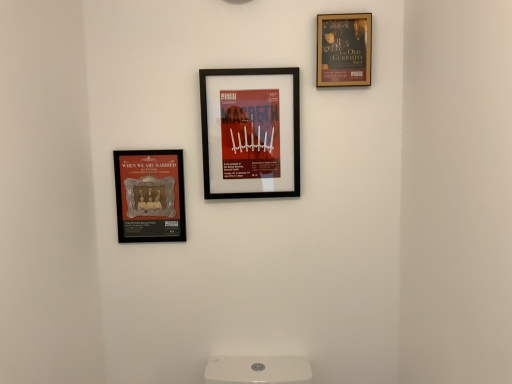
Question: Choose the correct answer: Is gold-framed poster at upper right, the first picture frame positioned from the right, inside matte black picture frame at center, marked as the 2th picture frame in a right-to-left arrangement, or outside it?

Choices:
 (A) inside
 (B) outside

Answer: (B)

Question: Is point (320, 23) closer or farther from the camera than point (232, 190)?

Choices:
 (A) farther
 (B) closer

Answer: (B)

Question: Which is nearer to the gold-framed poster at upper right, the first picture frame positioned from the right?

Choices:
 (A) matte gold plaque at left, the 3th picture frame when ordered from right to left
 (B) matte black picture frame at center, marked as the 2th picture frame in a right-to-left arrangement

Answer: (B)

Question: Which object is the farthest from the matte black picture frame at center, acting as the second picture frame starting from the left?

Choices:
 (A) gold-framed poster at upper right, the first picture frame positioned from the right
 (B) matte gold plaque at left, the first picture frame positioned from the left

Answer: (A)